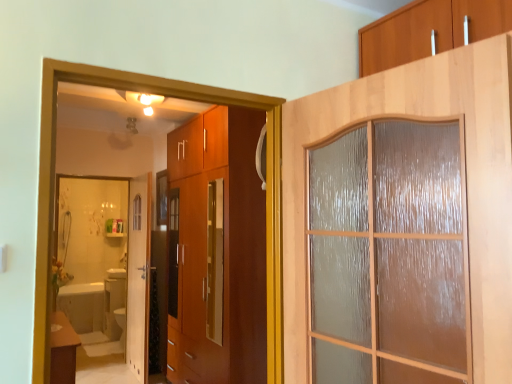
Question: From the image's perspective, would you say matte brown table at lower left is positioned over wooden frosted glass door at upper right, acting as the 1th door starting from the right?

Choices:
 (A) yes
 (B) no

Answer: (B)

Question: Could wooden frosted glass door at upper right, the 2th door when ordered from left to right, be considered to be inside matte brown table at lower left?

Choices:
 (A) no
 (B) yes

Answer: (A)

Question: Is matte brown table at lower left closer to the viewer compared to wooden frosted glass door at upper right, the first door when ordered from front to back?

Choices:
 (A) yes
 (B) no

Answer: (B)

Question: Can we say matte brown table at lower left lies outside wooden frosted glass door at upper right, acting as the 1th door starting from the right?

Choices:
 (A) no
 (B) yes

Answer: (B)

Question: Considering the relative sizes of matte brown table at lower left and wooden frosted glass door at upper right, the 2th door when ordered from left to right, in the image provided, is matte brown table at lower left bigger than wooden frosted glass door at upper right, the 2th door when ordered from left to right,?

Choices:
 (A) no
 (B) yes

Answer: (A)

Question: Considering the positions of white glossy bathtub at lower left and white glossy mirror at lower left in the image, is white glossy bathtub at lower left taller or shorter than white glossy mirror at lower left?

Choices:
 (A) tall
 (B) short

Answer: (B)

Question: In terms of width, does white glossy bathtub at lower left look wider or thinner when compared to white glossy mirror at lower left?

Choices:
 (A) wide
 (B) thin

Answer: (A)

Question: Is point (87, 327) closer or farther from the camera than point (72, 213)?

Choices:
 (A) closer
 (B) farther

Answer: (A)

Question: Is white glossy bathtub at lower left inside or outside of white glossy mirror at lower left?

Choices:
 (A) inside
 (B) outside

Answer: (B)

Question: In terms of size, does white glossy bathtub at lower left appear bigger or smaller than white glossy door at center, the 1th door positioned from the back?

Choices:
 (A) big
 (B) small

Answer: (A)

Question: Would you say white glossy bathtub at lower left is to the left or to the right of white glossy door at center, the 1th door positioned from the back, in the picture?

Choices:
 (A) left
 (B) right

Answer: (A)

Question: From a real-world perspective, is white glossy bathtub at lower left above or below white glossy door at center, acting as the second door starting from the front?

Choices:
 (A) above
 (B) below

Answer: (B)

Question: Which is correct: white glossy bathtub at lower left is inside white glossy door at center, the 1th door positioned from the back, or outside of it?

Choices:
 (A) inside
 (B) outside

Answer: (B)

Question: Based on their sizes in the image, would you say white glossy mirror at lower left is bigger or smaller than white glossy bathtub at lower left?

Choices:
 (A) big
 (B) small

Answer: (B)

Question: Which is correct: white glossy mirror at lower left is inside white glossy bathtub at lower left, or outside of it?

Choices:
 (A) outside
 (B) inside

Answer: (A)